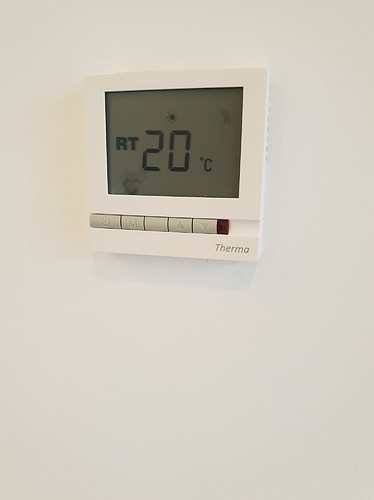
Find the location of a particular element. This screenshot has height=500, width=374. screen is located at coordinates (208, 118).